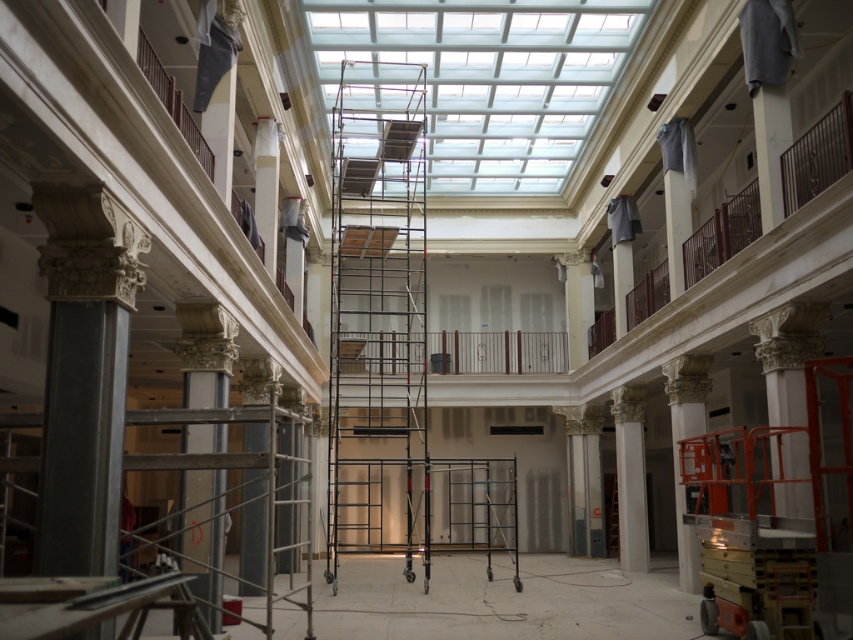
Consider the image. You are an architect inspecting the construction site. You notice the black metal scaffolding at center and the white marble pillar at center. Which object is wider?

The black metal scaffolding at center is wider than the white marble pillar at center.

You are standing at the entrance of the building and want to reach the central atrium. According to the image, where is the black metal scaffolding at center located in relation to your current position?

The black metal scaffolding at center is located at point 0.492 on the x axis and 0.443 on the y axis, which is near the center of the image. Since you are at the entrance, it would be directly ahead of you in the central atrium.

You are standing in the atrium of a large building undergoing renovation. You notice a point marked at coordinates (344, 413). If you want to reach this point, how far will you have to walk from your current position?

The point at coordinates (344, 413) is 24.61 meters away from the viewer, so you will have to walk approximately 24.61 meters to reach it.